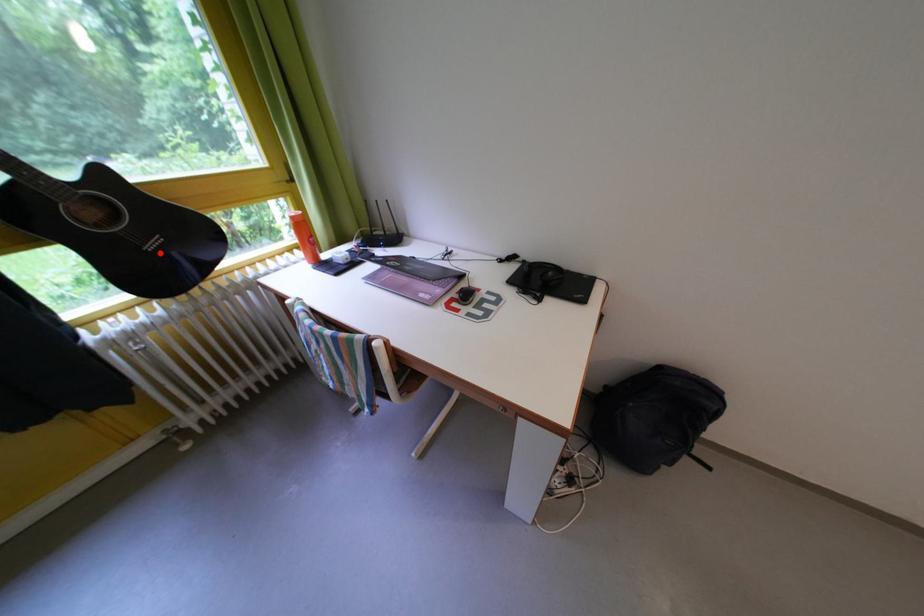
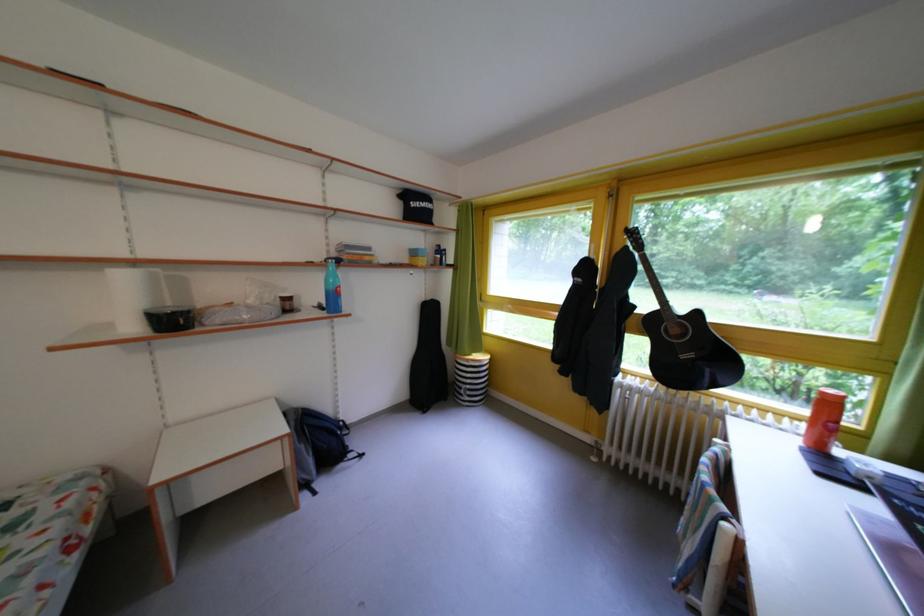
Question: I am providing you with two images of the same scene from different viewpoints. Image1 has a red point marked. In image2, the corresponding 3D location appears at what relative position? Reply with the corresponding letter.

Choices:
 (A) Closer
 (B) Farther

Answer: (A)